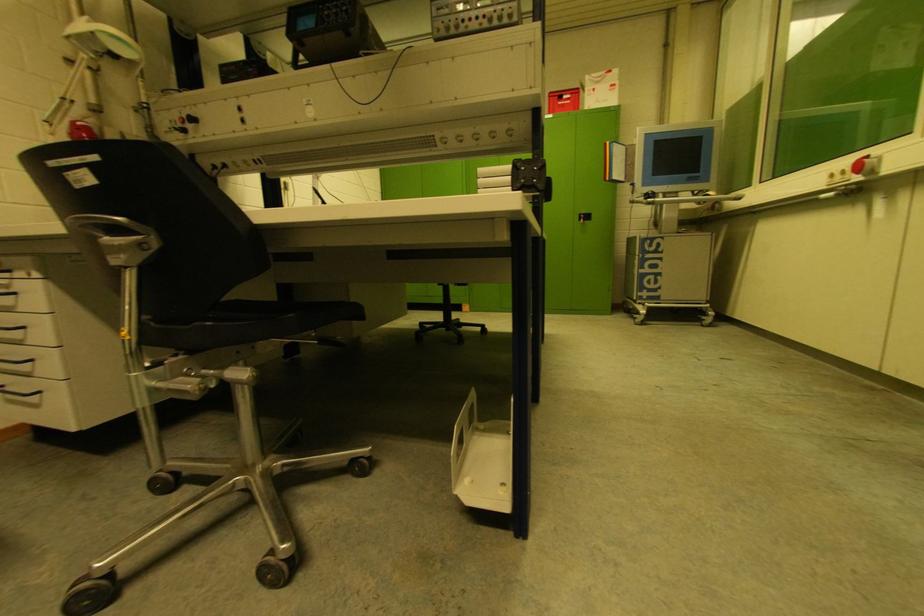
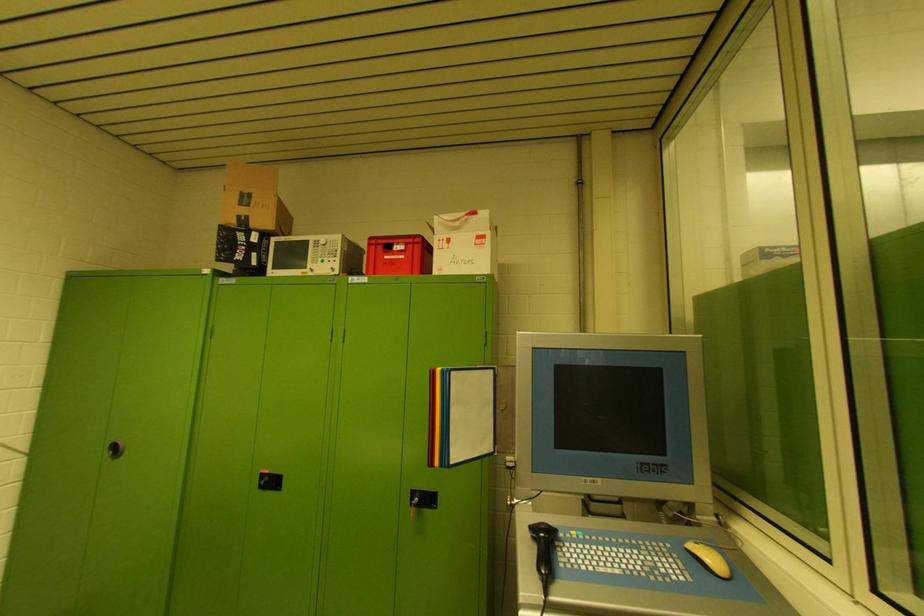
Which direction would the cameraman need to move to produce the second image?

The cameraman moved toward right, forward.